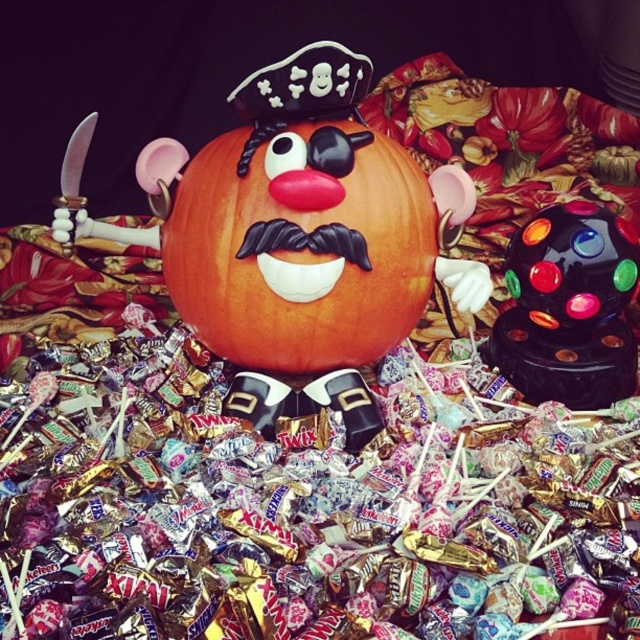
You are a child who wants to grab the metallic foil wrapped candy at center and the shiny plastic ball at center from the pile. Which one is easier to reach?

The metallic foil wrapped candy at center is below the shiny plastic ball at center, so the shiny plastic ball at center is easier to reach because it is on top.

You are standing in front of a Halloween display and see the orange matte pumpkin at center. Where exactly is it located in terms of coordinates?

The orange matte pumpkin at center is located at coordinates point (300,246).

You are a child looking at the Halloween display. You see the orange matte pumpkin at center and the shiny plastic ball at center. Which object is positioned higher in the scene?

The orange matte pumpkin at center is located above the shiny plastic ball at center, so it is positioned higher in the scene.